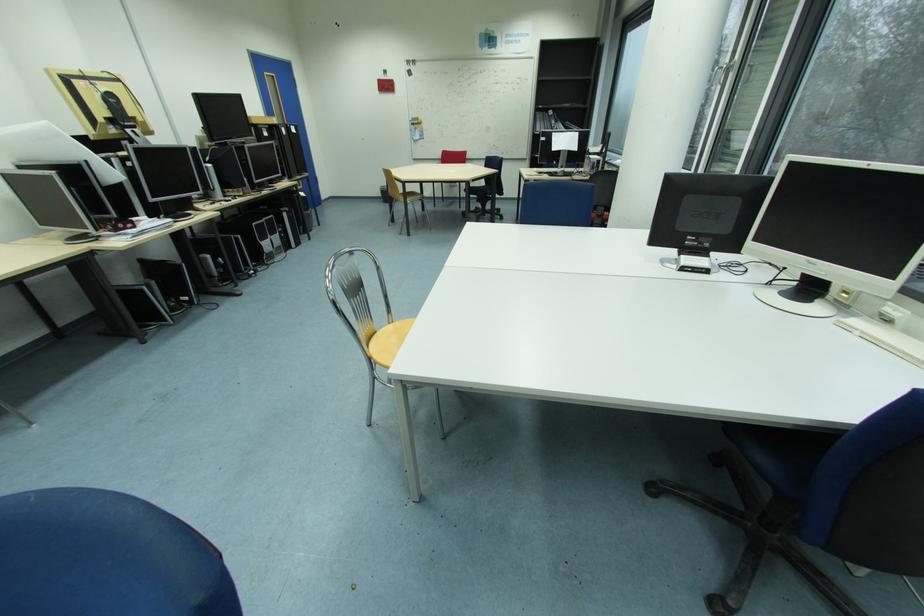
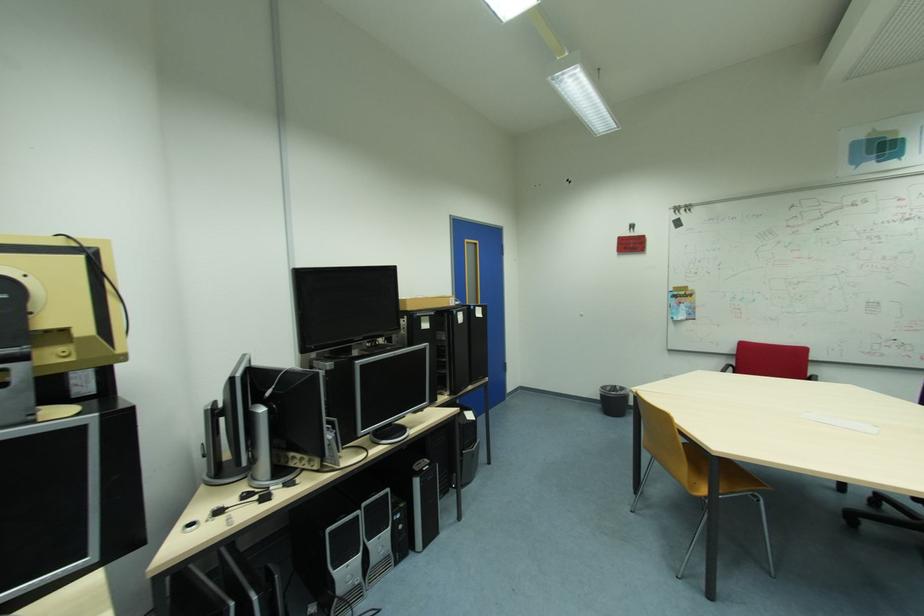
Find the pixel in the second image that matches (x=293, y=215) in the first image.

(424, 482)